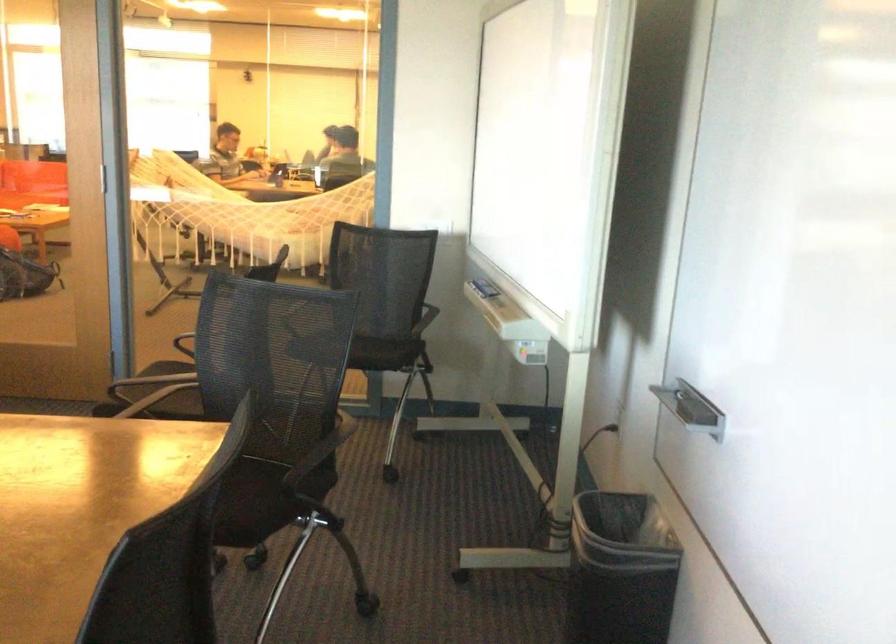
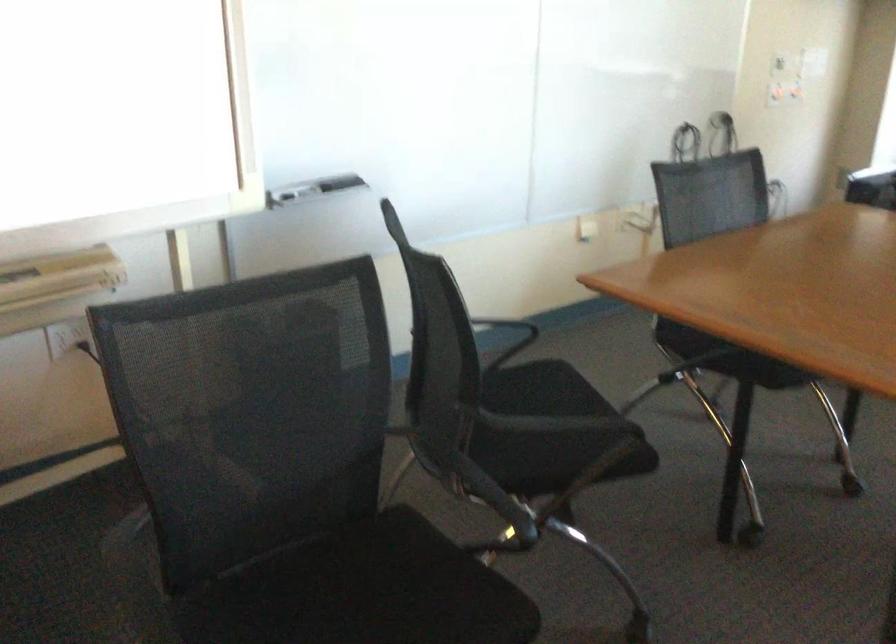
Question: I am providing you with two images of the same scene from different viewpoints. After the viewpoint changes to image2, which objects are now occluded?

Choices:
 (A) black trash can
 (B) whiteboard marker tray
 (C) yellow clipboard
 (D) black chair sitting surface

Answer: (A)